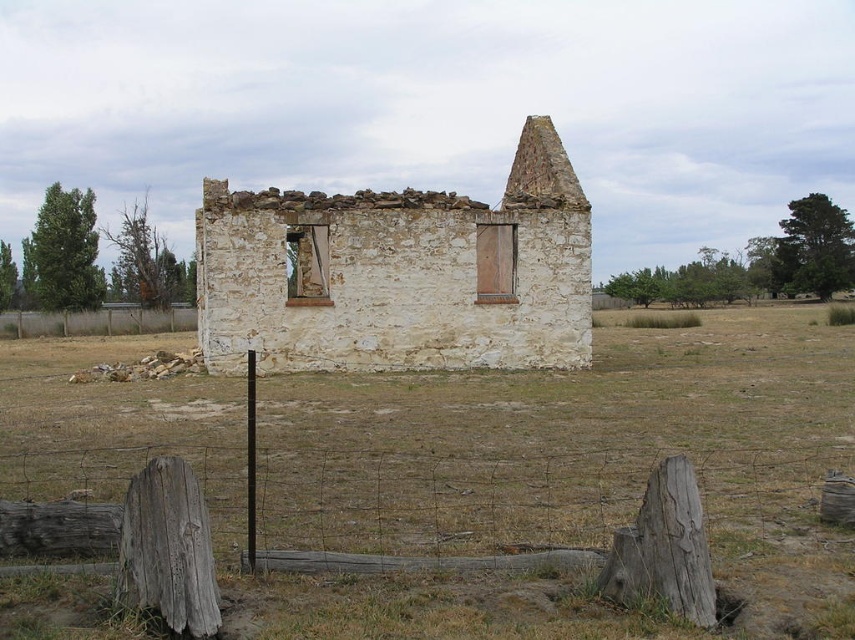
Question: Can you confirm if white stone wall at center is smaller than brown wooden fence at lower left?

Choices:
 (A) no
 (B) yes

Answer: (B)

Question: Which of the following is the closest to the observer?

Choices:
 (A) brown wooden fence at lower left
 (B) white stone wall at center

Answer: (B)

Question: Can you confirm if white stone wall at center is positioned above brown wooden fence at lower left?

Choices:
 (A) yes
 (B) no

Answer: (A)

Question: Does white stone wall at center appear on the right side of brown wooden fence at lower left?

Choices:
 (A) no
 (B) yes

Answer: (B)